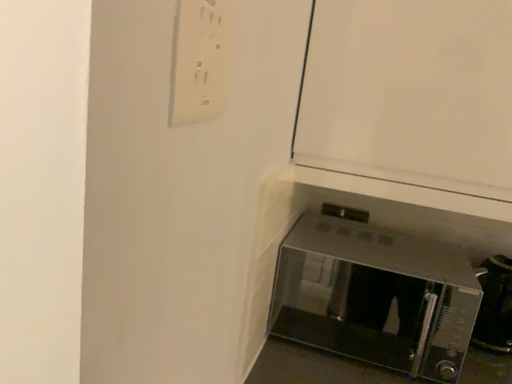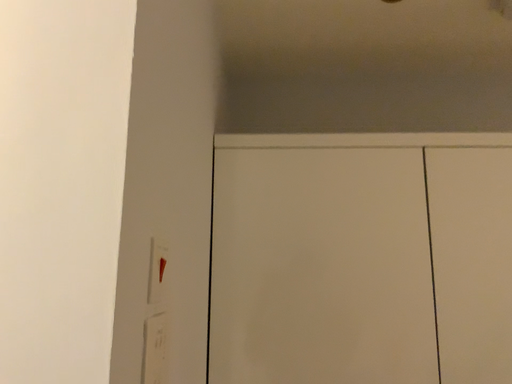
Question: How did the camera likely rotate when shooting the video?

Choices:
 (A) rotated upward
 (B) rotated downward

Answer: (A)